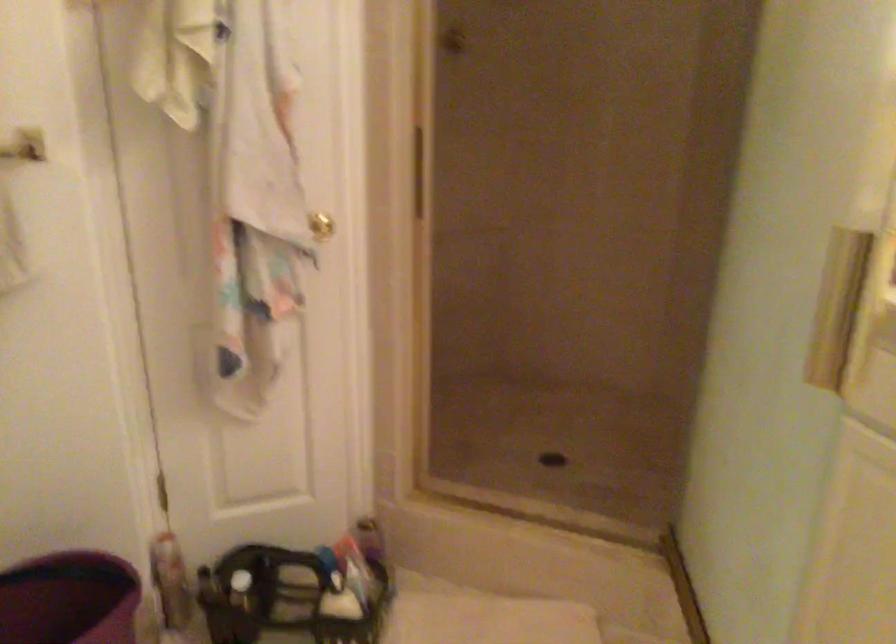
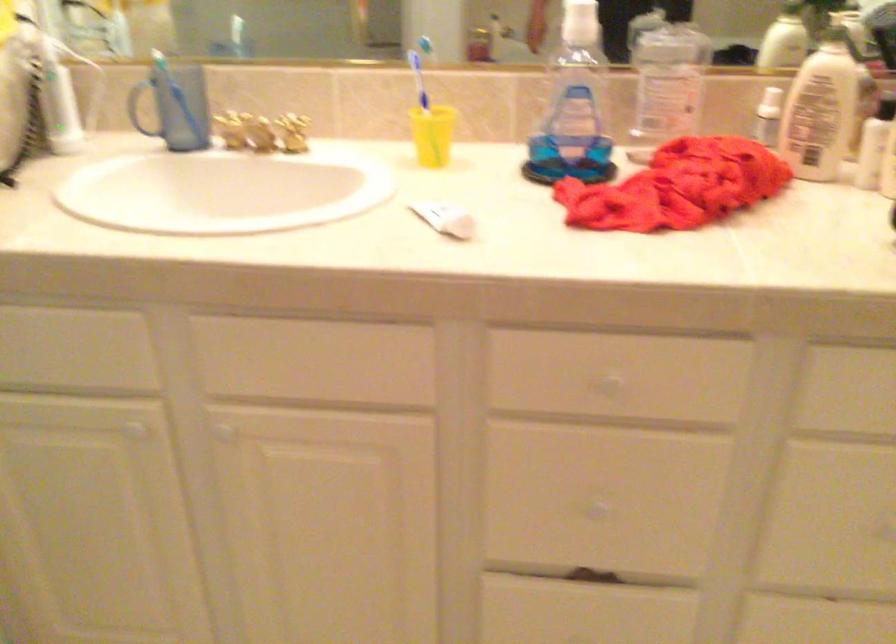
Based on the continuous images, in which direction is the camera rotating?

The rotation direction of the camera is right-down.